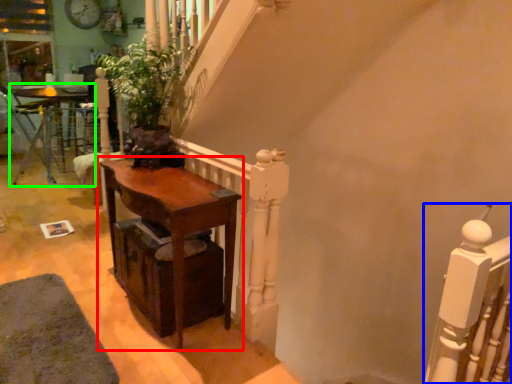
Question: Which object is the closest to the table (highlighted by a red box)? Choose among these: rail (highlighted by a blue box) or table (highlighted by a green box).

Choices:
 (A) rail
 (B) table

Answer: (A)